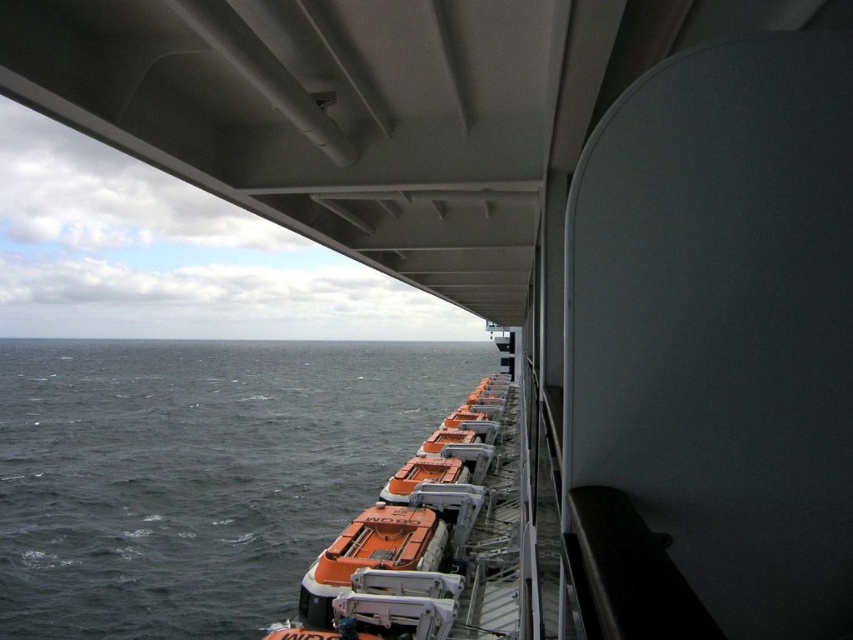
You are standing inside the ship and looking at two points on the exterior railing. The first point is at coordinates point (190, 445) and the second point is at point (386, 528). Which point is closer to you?

Point (190, 445) is closer to you because it is further to the viewer than point (386, 528).